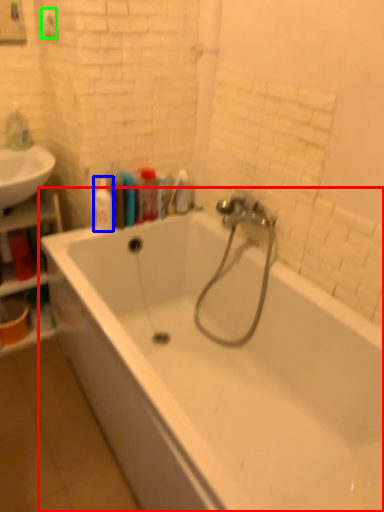
Question: Which object is the farthest from bathtub (highlighted by a red box)? Choose among these: toiletry (highlighted by a blue box) or towel bar (highlighted by a green box).

Choices:
 (A) toiletry
 (B) towel bar

Answer: (B)